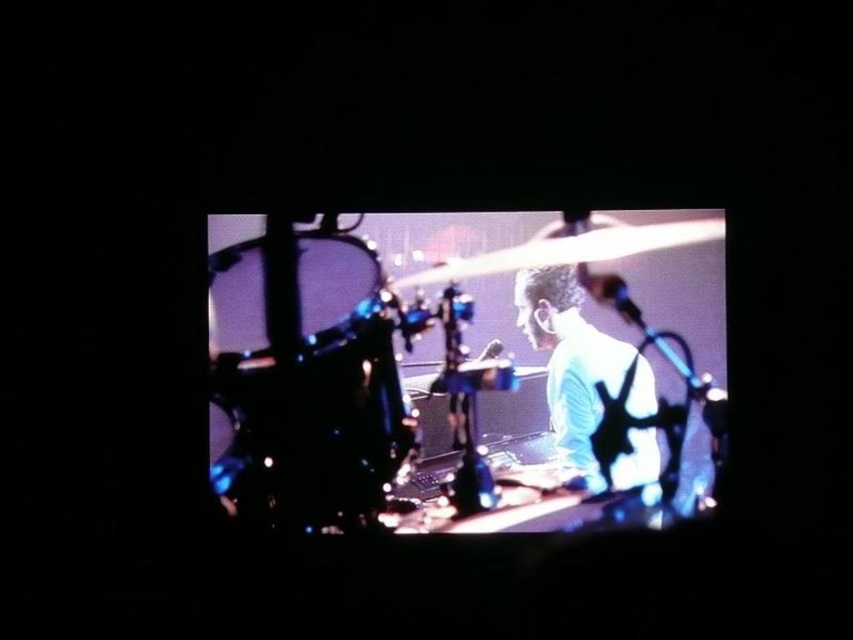
Does point (315, 486) lie behind point (558, 332)?

That is True.

Does shiny black drum at left have a lesser height compared to light blue fabric at center?

Incorrect, shiny black drum at left's height does not fall short of light blue fabric at center's.

Is point (254, 452) in front of point (564, 317)?

Yes, point (254, 452) is in front of point (564, 317).

At what (x,y) coordinates should I click in order to perform the action: click on shiny black drum at left. Please return your answer as a coordinate pair (x, y). This screenshot has width=853, height=640. Looking at the image, I should click on (305, 380).